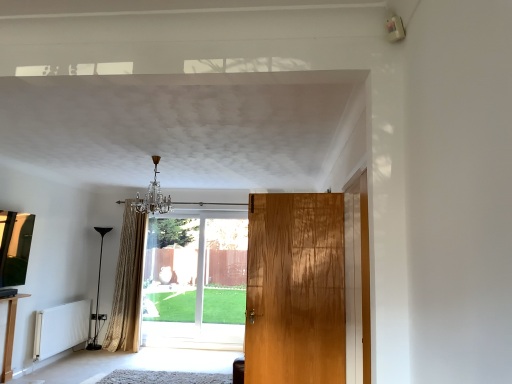
Question: From a real-world perspective, is crystal glass chandelier at upper center positioned above or below gold textured curtain at center?

Choices:
 (A) below
 (B) above

Answer: (B)

Question: In terms of height, does crystal glass chandelier at upper center look taller or shorter compared to gold textured curtain at center?

Choices:
 (A) short
 (B) tall

Answer: (A)

Question: Estimate the real-world distances between objects in this image. Which object is farther from the light brown wood table at lower left?

Choices:
 (A) light brown wood door at center, the first door in the right-to-left sequence
 (B) crystal glass chandelier at upper center
 (C) gold textured curtain at center
 (D) white matte radiator at lower left
 (E) clear glass door at center, which ranks as the first door in left-to-right order

Answer: (A)

Question: Which object is positioned closest to the black glass floor lamp at left?

Choices:
 (A) gold textured curtain at center
 (B) light brown wood table at lower left
 (C) crystal glass chandelier at upper center
 (D) light brown wood door at center, the first door in the right-to-left sequence
 (E) white matte radiator at lower left

Answer: (E)